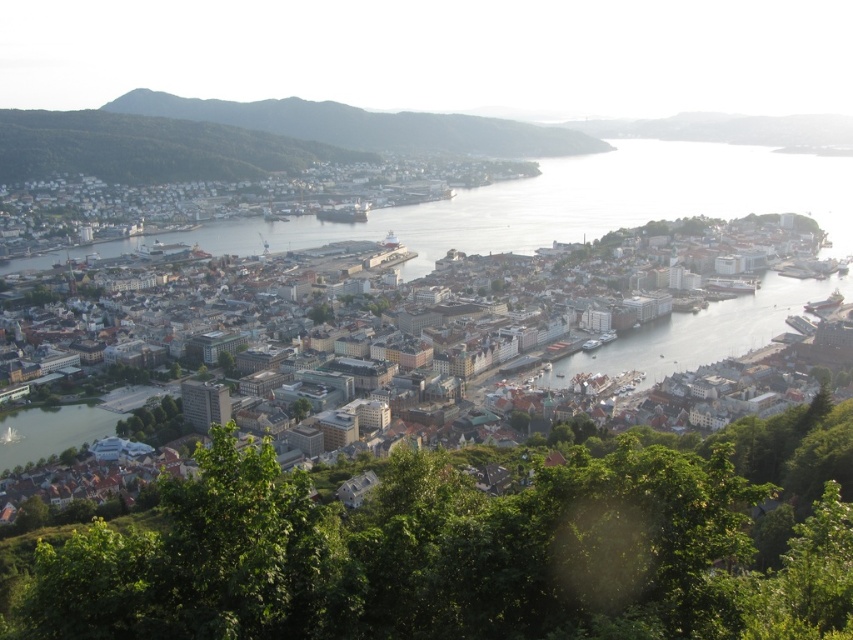
Question: Estimate the real-world distances between objects in this image. Which object is closer to the green forested hillside at upper left?

Choices:
 (A) green leafy tree at lower center
 (B) white matte buildings at center

Answer: (B)

Question: Which of the following is the closest to the observer?

Choices:
 (A) white matte buildings at center
 (B) green forested hillside at upper left
 (C) green leafy tree at lower center

Answer: (C)

Question: Does green leafy tree at lower center appear under white matte buildings at center?

Choices:
 (A) yes
 (B) no

Answer: (A)

Question: Among these objects, which one is nearest to the camera?

Choices:
 (A) green forested hillside at upper left
 (B) white matte buildings at center
 (C) green leafy tree at lower center

Answer: (C)

Question: From the image, what is the correct spatial relationship of green leafy tree at lower center in relation to white matte buildings at center?

Choices:
 (A) above
 (B) below

Answer: (B)

Question: Where is green leafy tree at lower center located in relation to white matte buildings at center in the image?

Choices:
 (A) above
 (B) below

Answer: (B)